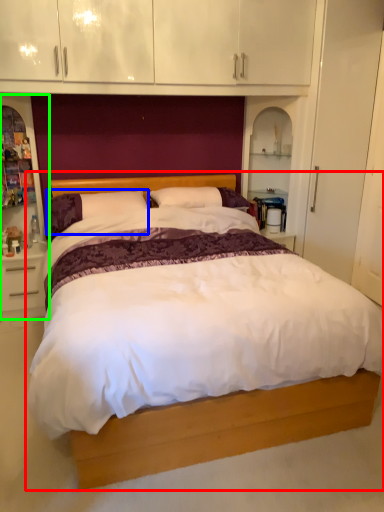
Question: Considering the real-world distances, which object is closest to bed (highlighted by a red box)? pillow (highlighted by a blue box) or dresser (highlighted by a green box).

Choices:
 (A) pillow
 (B) dresser

Answer: (A)